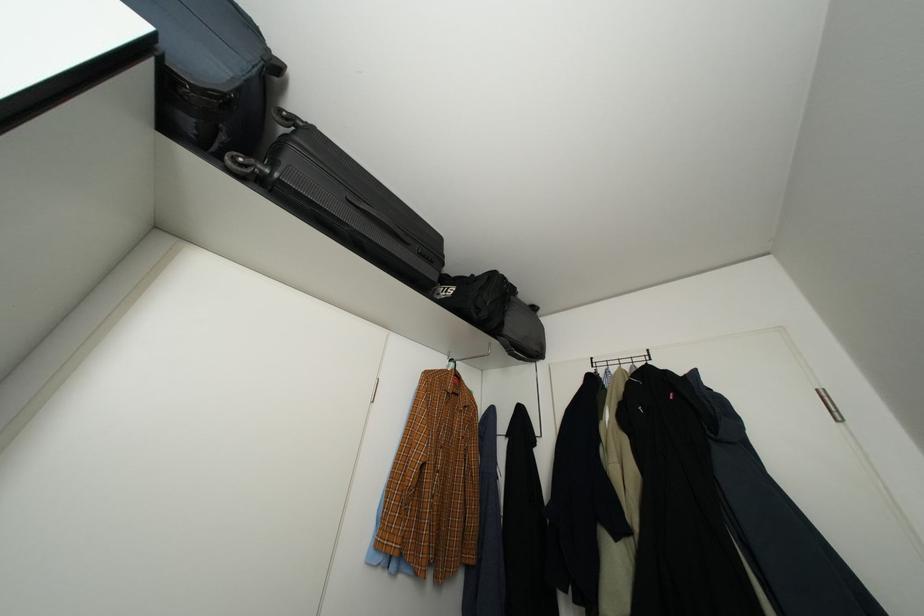
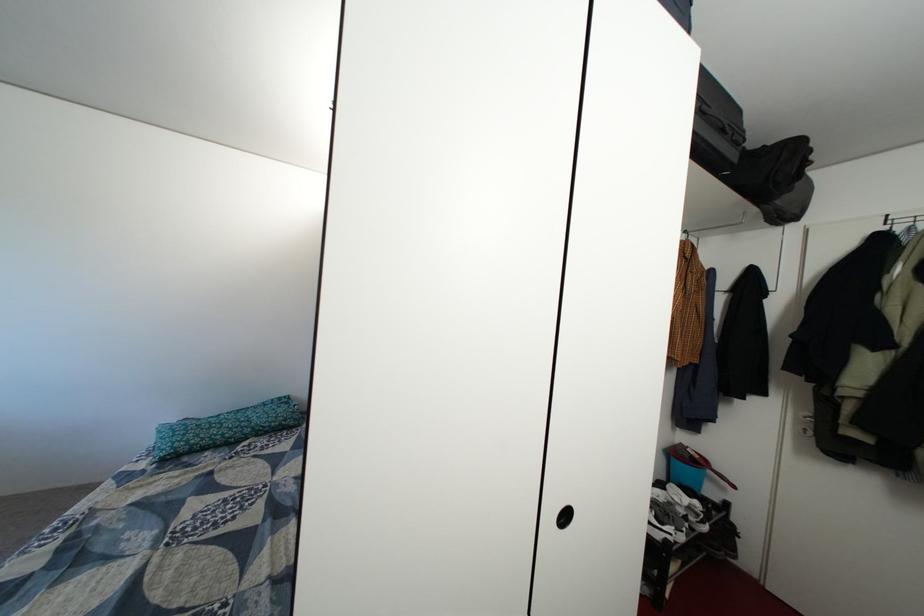
Question: I am providing you with two images of the same scene from different viewpoints. Which of the following objects are not visible in image2?

Choices:
 (A) recessed cabinet handle
 (B) black suitcase handle
 (C) white door handle
 (D) black plug

Answer: (B)